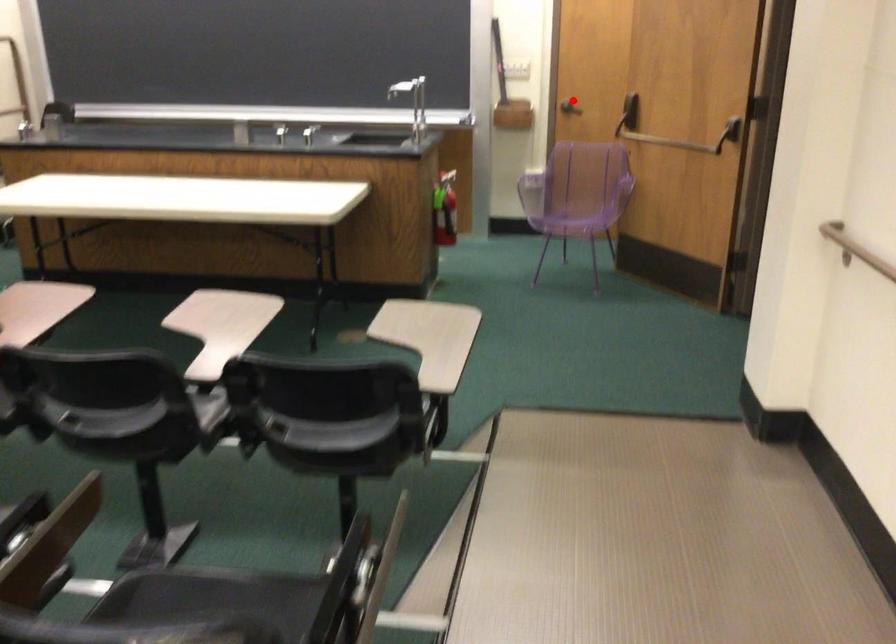
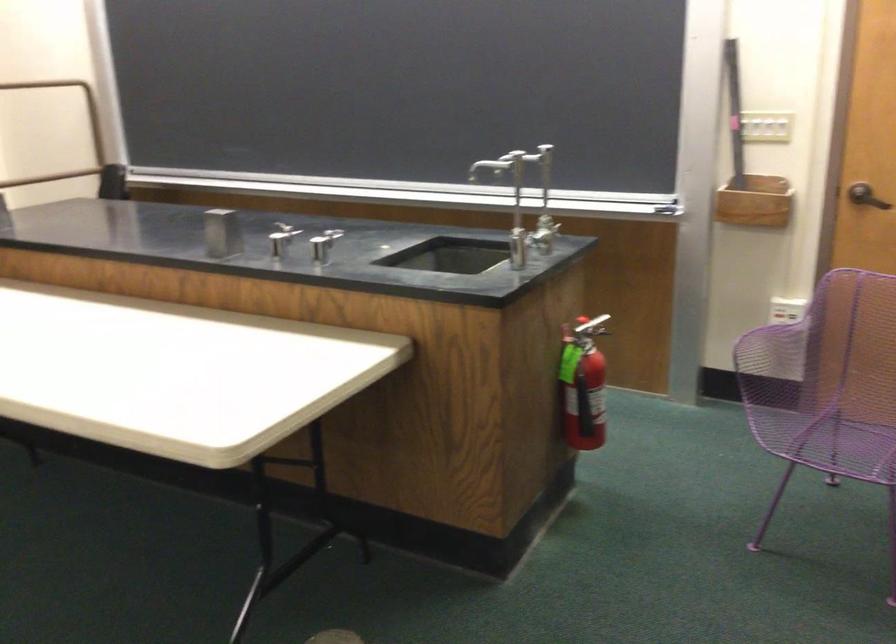
Question: I am providing you with two images of the same scene from different viewpoints. Given a red point in image1, look at the same physical point in image2. Is it:

Choices:
 (A) Closer to the viewpoint
 (B) Farther from the viewpoint

Answer: (A)